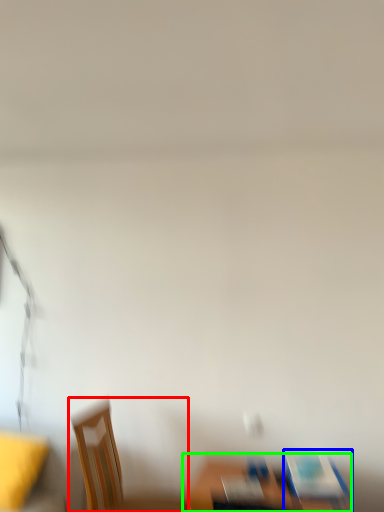
Question: Considering the real-world distances, which object is closest to chair (highlighted by a red box)? chair (highlighted by a blue box) or furniture (highlighted by a green box).

Choices:
 (A) chair
 (B) furniture

Answer: (B)